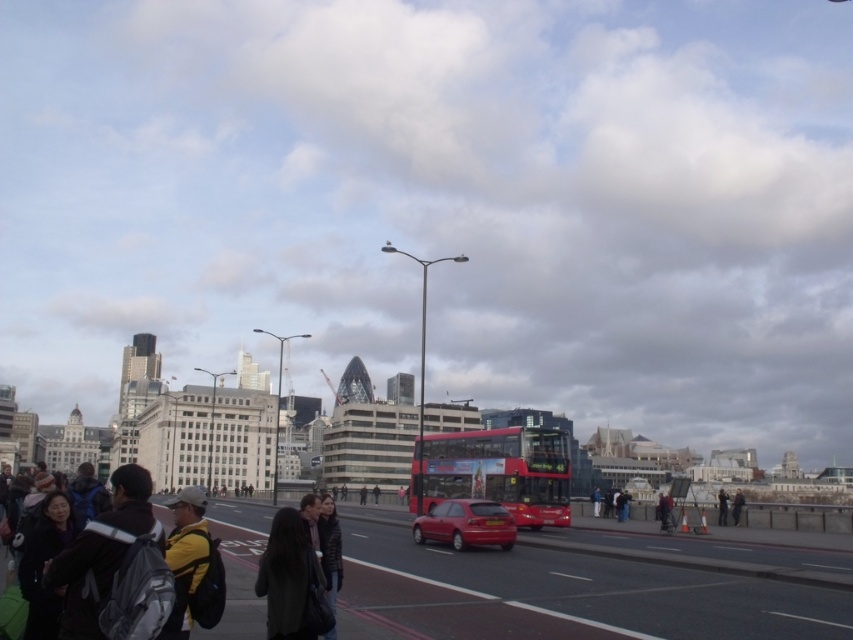
Question: Is red metallic bus at center further to the viewer compared to shiny red car at center?

Choices:
 (A) no
 (B) yes

Answer: (B)

Question: Estimate the real-world distances between objects in this image. Which object is farther from the shiny red car at center?

Choices:
 (A) dark gray coat at center
 (B) yellow fabric jacket at lower left

Answer: (B)

Question: From the image, what is the correct spatial relationship of dark gray coat at center in relation to shiny red car at center?

Choices:
 (A) left
 (B) right

Answer: (A)

Question: Considering the relative positions of yellow fabric jacket at lower left and dark gray jacket at center in the image provided, where is yellow fabric jacket at lower left located with respect to dark gray jacket at center?

Choices:
 (A) left
 (B) right

Answer: (A)

Question: Which point is closer to the camera taking this photo?

Choices:
 (A) (718, 513)
 (B) (488, 432)
 (C) (175, 595)
 (D) (490, 531)

Answer: (C)

Question: Which point is closer to the camera?

Choices:
 (A) (271, 612)
 (B) (722, 499)
 (C) (180, 573)

Answer: (C)